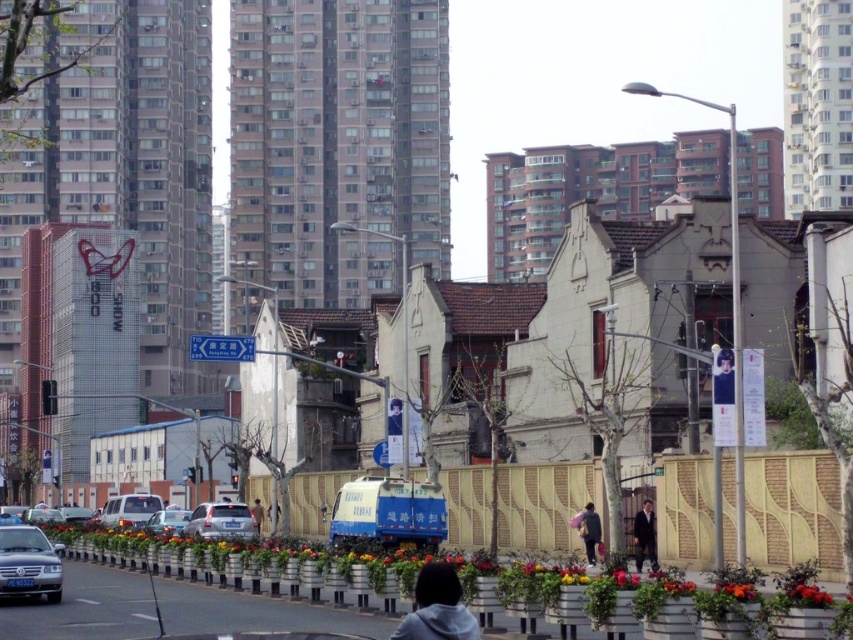
Question: Can you confirm if silver metallic sedan at lower left is positioned to the right of dark suit at center?

Choices:
 (A) no
 (B) yes

Answer: (A)

Question: Can you confirm if dark blue uniform at center is thinner than smooth black jacket at center?

Choices:
 (A) yes
 (B) no

Answer: (B)

Question: Which point is farther to the camera?

Choices:
 (A) (432, 545)
 (B) (251, 532)
 (C) (712, 369)
 (D) (173, 529)

Answer: (D)

Question: Which of the following is the closest to the observer?

Choices:
 (A) (47, 557)
 (B) (595, 518)
 (C) (383, 488)
 (D) (444, 609)

Answer: (D)

Question: Can you confirm if blue metallic truck at center is wider than satin silver sedan at center?

Choices:
 (A) no
 (B) yes

Answer: (A)

Question: Which object is farther from the camera taking this photo?

Choices:
 (A) matte silver sedan at lower left
 (B) satin silver sedan at center

Answer: (A)